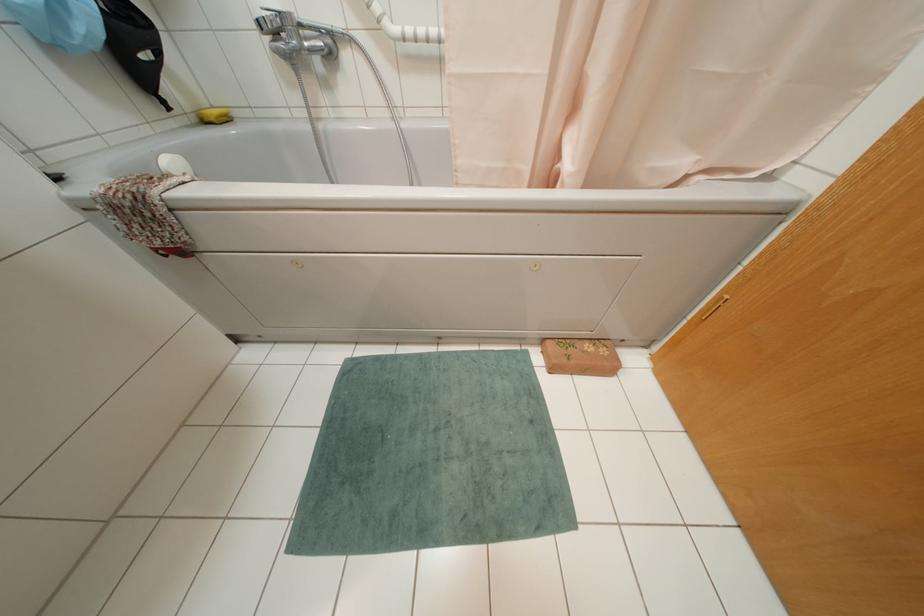
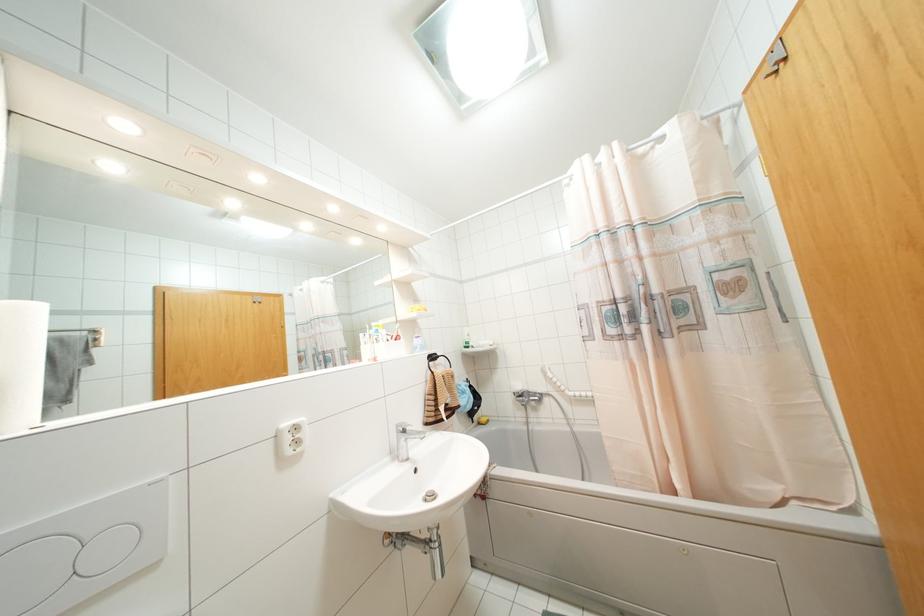
Consider the image. The first image is from the beginning of the video and the second image is from the end. How did the camera likely rotate when shooting the video?

The camera's rotation is toward left-up.